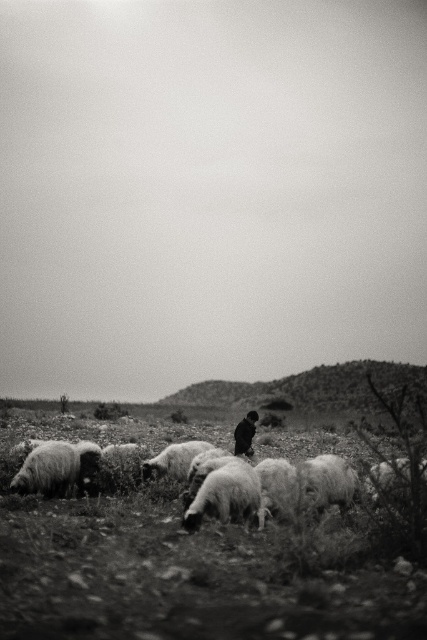
Question: Does fluffy white sheep at center appear on the left side of fuzzy woolly sheep at center?

Choices:
 (A) no
 (B) yes

Answer: (A)

Question: Is fuzzy woolly sheep at center to the left of fluffy white sheep at lower left from the viewer's perspective?

Choices:
 (A) no
 (B) yes

Answer: (A)

Question: Which object is the farthest from the fluffy white wool at center?

Choices:
 (A) fuzzy woolly sheep at center
 (B) dark fur coat at center
 (C) fluffy white sheep at center
 (D) fluffy white sheep at lower left

Answer: (B)

Question: Which is farther from the fluffy white sheep at center?

Choices:
 (A) fluffy white sheep at lower left
 (B) fluffy white wool at center

Answer: (A)

Question: Is fuzzy woolly sheep at center wider than fluffy white wool at lower center?

Choices:
 (A) yes
 (B) no

Answer: (B)

Question: Among these points, which one is nearest to the camera?

Choices:
 (A) (345, 497)
 (B) (195, 499)
 (C) (40, 483)

Answer: (B)